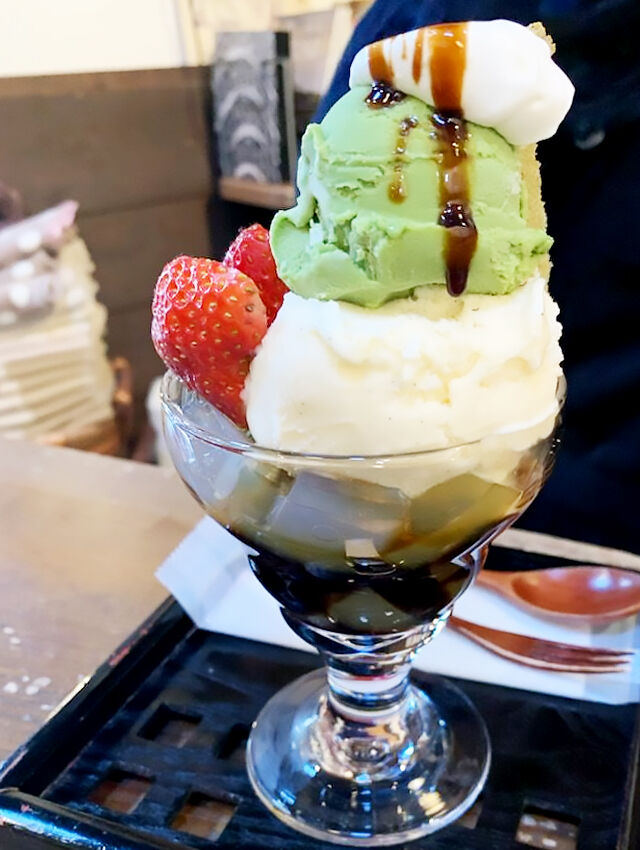
Image resolution: width=640 pixels, height=850 pixels. I want to click on white table, so click(68, 505).